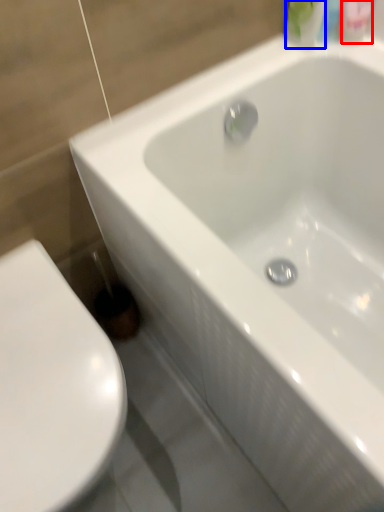
Question: Which point is closer to the camera, mouthwash (highlighted by a red box) or mouthwash (highlighted by a blue box)?

Choices:
 (A) mouthwash
 (B) mouthwash

Answer: (B)